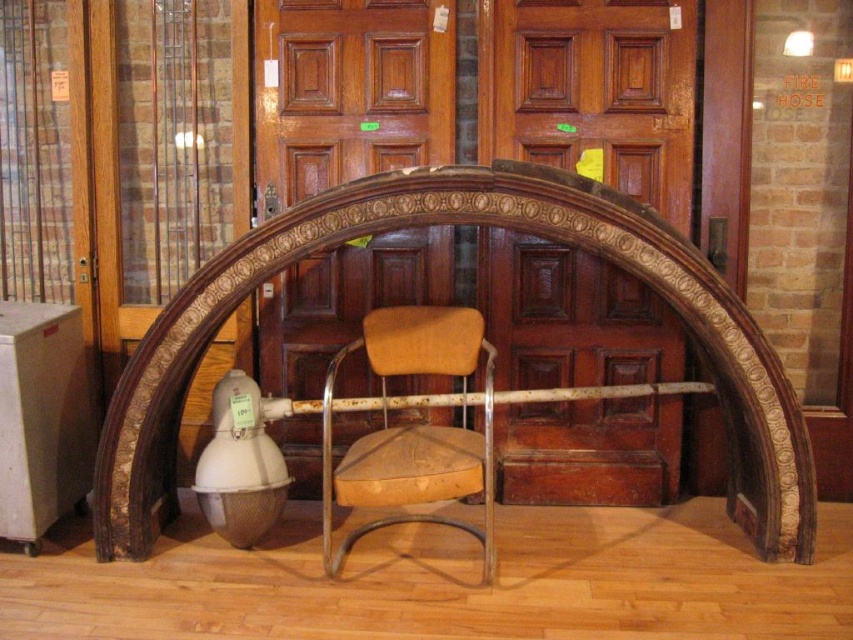
In the scene shown: You are standing in a room with a brown carved wood archway at center and a brown leather chair at center. Which object is closer to you?

The brown leather chair at center is closer to you because the brown carved wood archway at center is further away.

You are standing in a room with a brown carved wood archway at center. If you want to walk towards the archway, which direction should you face?

Since the brown carved wood archway at center is located at point coordinates, you should face towards the center of the room to walk towards it.